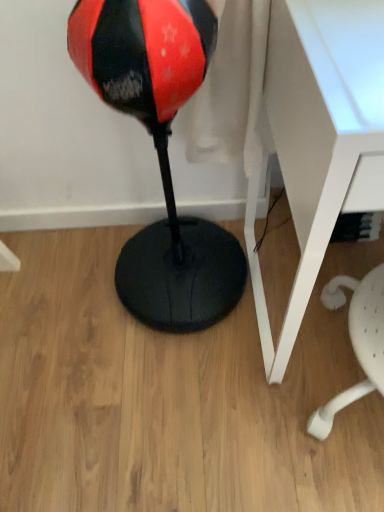
Identify the location of vacant space positioned to the left of red/black glossy bean bag at center. (66, 304).